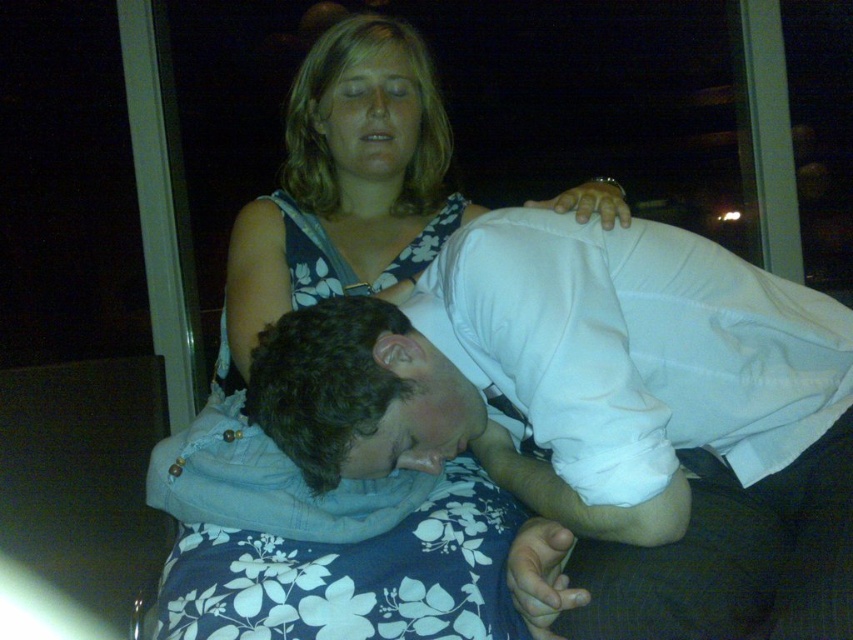
You are a photographer adjusting the focus of your camera. You want to capture a clear image of both the white cotton shirt at center and the blue floral dress at center. Since the camera can only focus on one object at a time, which one should you choose to ensure the closer object is in focus?

The white cotton shirt at center is closer to the viewer than the blue floral dress at center, so you should focus on the white cotton shirt at center to ensure the closer object is in focus.

You are a photographer setting up a night scene with two people. You have a spotlight that can only illuminate objects taller than 1.2 meters. Based on the scene, will the spotlight illuminate the white cotton shirt at center or the blue floral dress at center?

The blue floral dress at center is taller than the white cotton shirt at center. Since the spotlight requires objects taller than 1.2 meters, the blue floral dress at center will be illuminated, but the white cotton shirt at center may not reach the required height.

You are standing in front of the nighttime scene and want to place a small nightlight. You have two points marked as potential locations for the nightlight. The points are labeled as point 1 at coordinates point (314,449) and point 2 at coordinates point (271,520). Which point is closer to you where you can place the nightlight?

Point (314,449) is closer to the viewer than point (271,520), so you should place the nightlight at point (314,449).